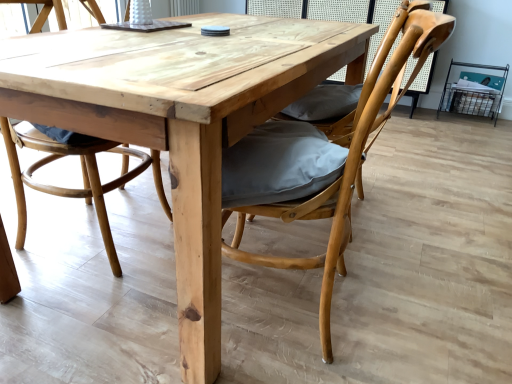
This screenshot has width=512, height=384. What are the coordinates of `free space in front of natural wood chair at center, the 2th chair viewed from the right` in the screenshot? It's located at (78, 310).